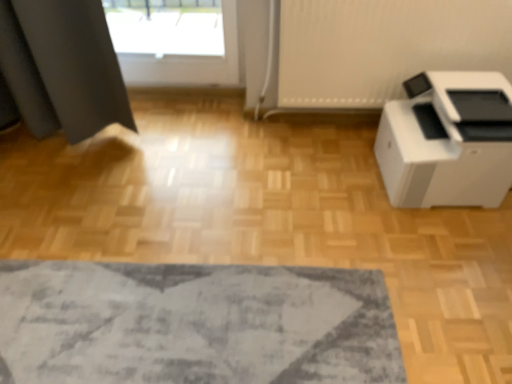
Locate an element on the screen. This screenshot has height=384, width=512. free space underneath textured gray rug at lower center (from a real-world perspective) is located at coordinates (191, 326).